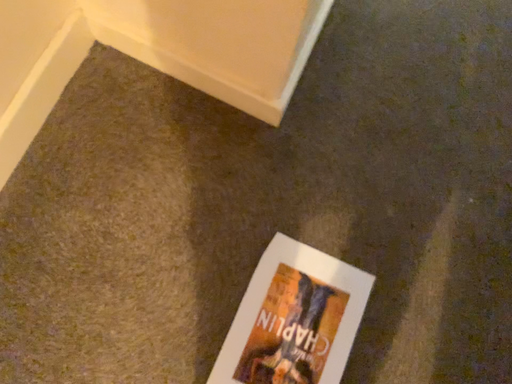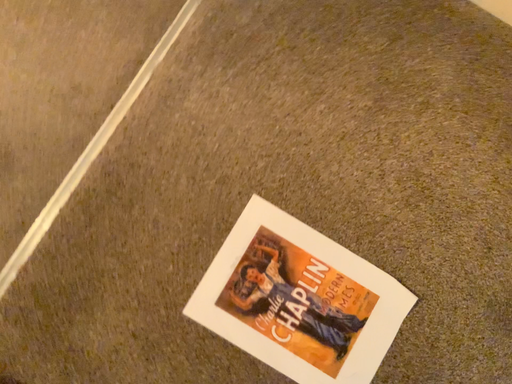
Question: Which way did the camera rotate in the video?

Choices:
 (A) rotated upward
 (B) rotated downward

Answer: (A)